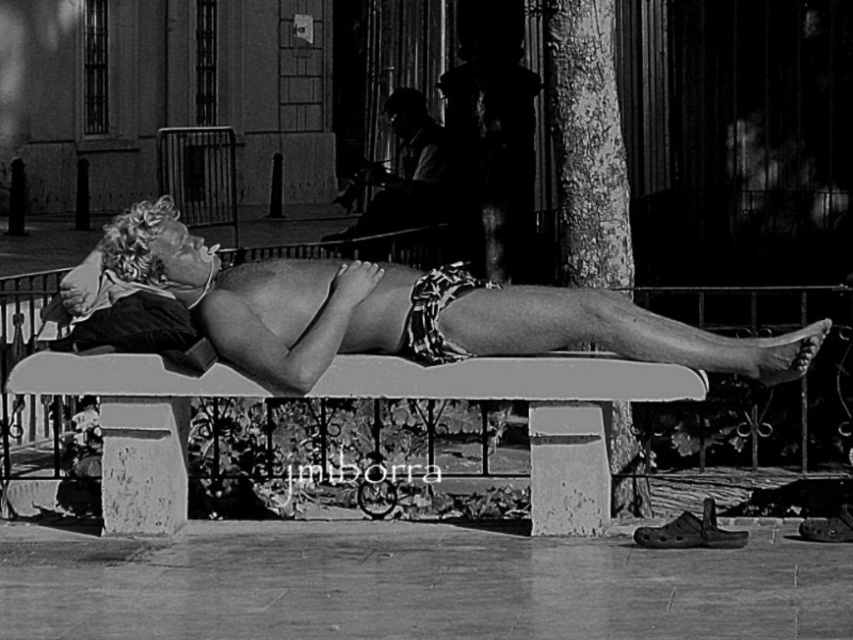
Between printed fabric bikini at center and smooth concrete bench at center, which one is positioned lower?

smooth concrete bench at center

What do you see at coordinates (399, 310) in the screenshot?
I see `printed fabric bikini at center` at bounding box center [399, 310].

The width and height of the screenshot is (853, 640). I want to click on printed fabric bikini at center, so click(x=399, y=310).

Is printed fabric bikini at center to the right of printed fabric shorts at center from the viewer's perspective?

No, printed fabric bikini at center is not to the right of printed fabric shorts at center.

From the picture: Measure the distance between printed fabric bikini at center and printed fabric shorts at center.

A distance of 58.15 centimeters exists between printed fabric bikini at center and printed fabric shorts at center.

Who is more forward, (286, 316) or (432, 298)?

Point (432, 298)

Find the location of `printed fabric bikini at center`. printed fabric bikini at center is located at coordinates (399, 310).

Does printed fabric bikini at center have a larger size compared to smooth leather jacket at upper center?

Indeed, printed fabric bikini at center has a larger size compared to smooth leather jacket at upper center.

The image size is (853, 640). I want to click on printed fabric bikini at center, so click(399, 310).

Find the location of a particular element. The image size is (853, 640). printed fabric bikini at center is located at coordinates pos(399,310).